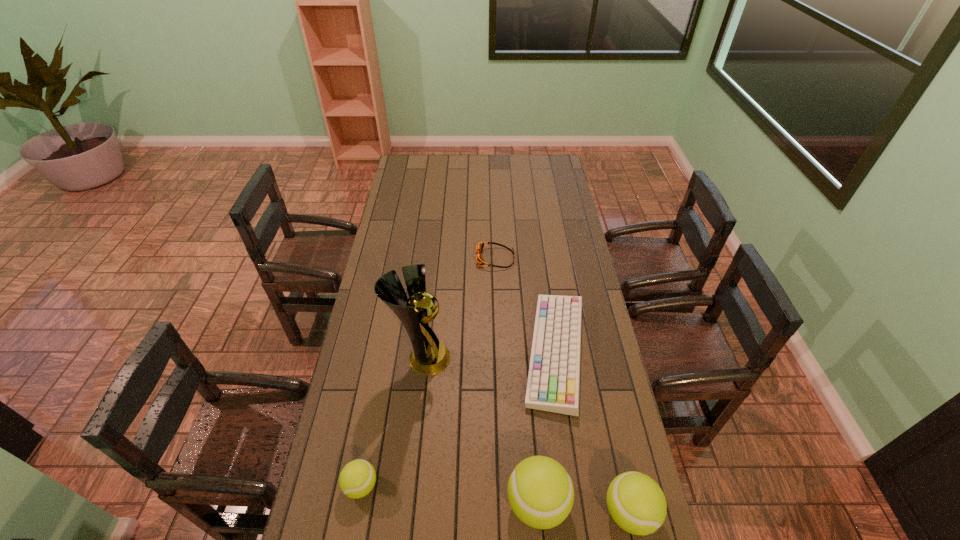
If the aim is uniform spacing by inserting an additional tennis_ball among them, please point to a vacant space for this new tennis_ball. Please provide its 2D coordinates. Your answer should be formatted as a tuple, i.e. [(x, y)], where the tuple contains the x and y coordinates of a point satisfying the conditions above.

[(448, 494)]